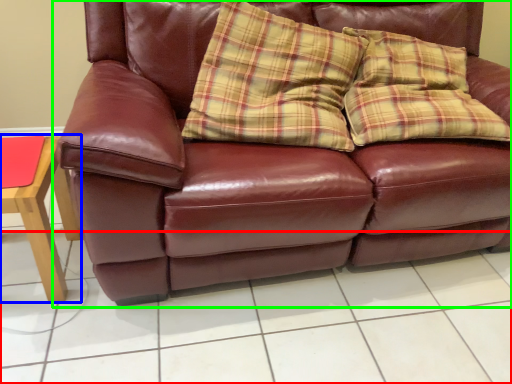
Question: Which is farther away from tile (highlighted by a red box)? table (highlighted by a blue box) or studio couch (highlighted by a green box)?

Choices:
 (A) table
 (B) studio couch

Answer: (A)